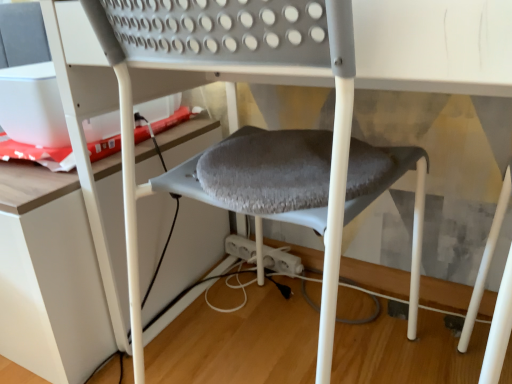
Locate an element on the screen. The height and width of the screenshot is (384, 512). white matte table at lower left is located at coordinates (50, 276).

The height and width of the screenshot is (384, 512). What do you see at coordinates (50, 276) in the screenshot?
I see `white matte table at lower left` at bounding box center [50, 276].

Locate an element on the screen. white matte table at lower left is located at coordinates (50, 276).